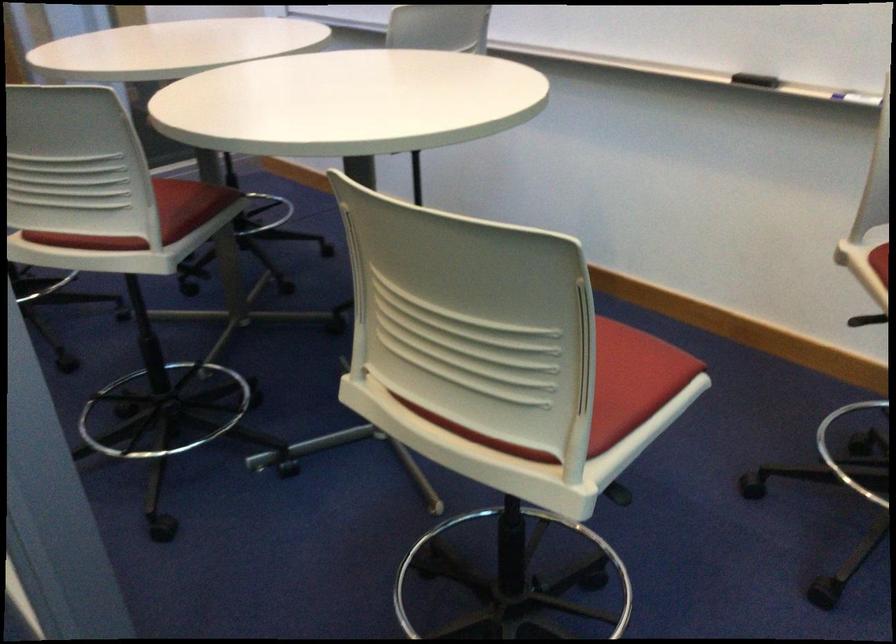
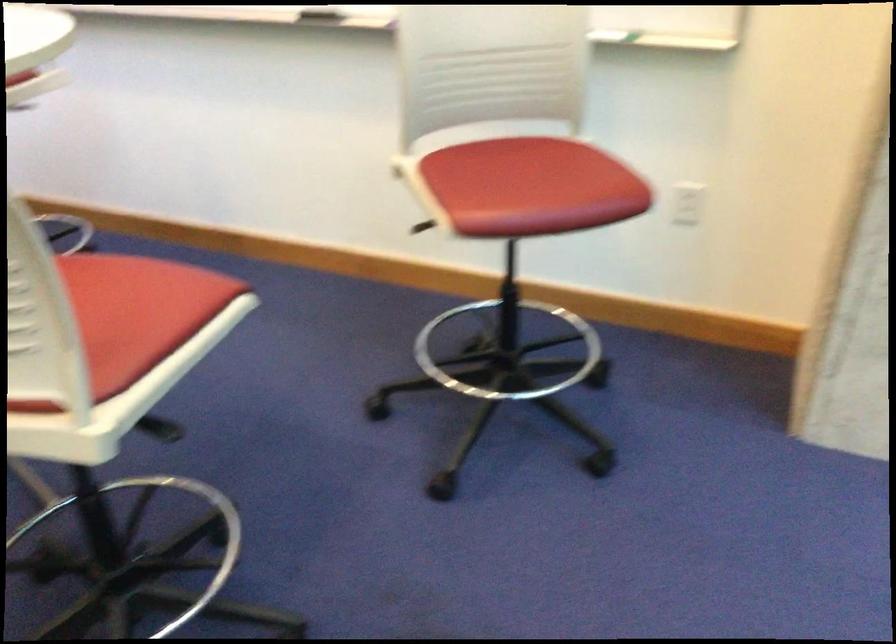
Question: How did the camera likely rotate?

Choices:
 (A) Left
 (B) Right
 (C) Up
 (D) Down

Answer: (B)